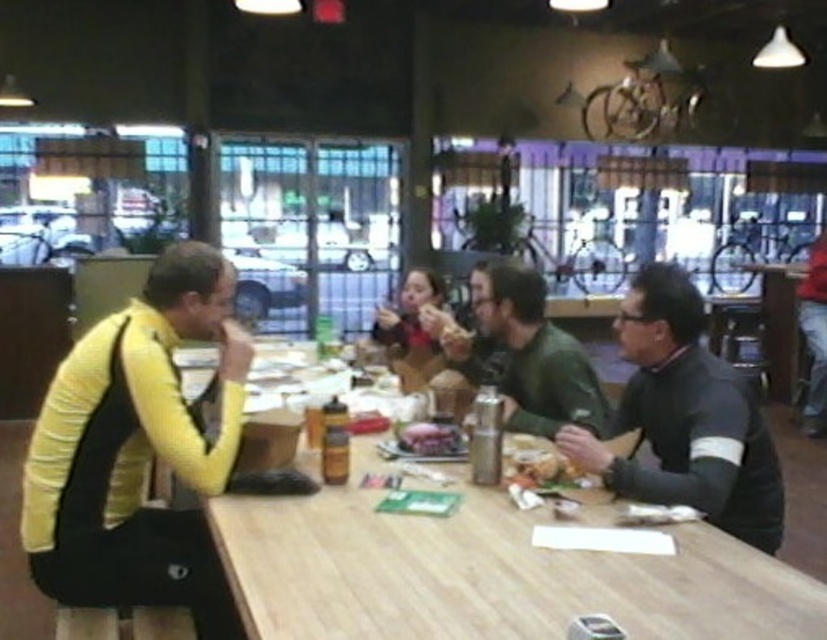
You are a server in a restaurant. You see a wooden table at center and a green matte jacket at center. Which object is closer to the floor?

The wooden table at center is located below green matte jacket at center, so the wooden table at center is closer to the floor.